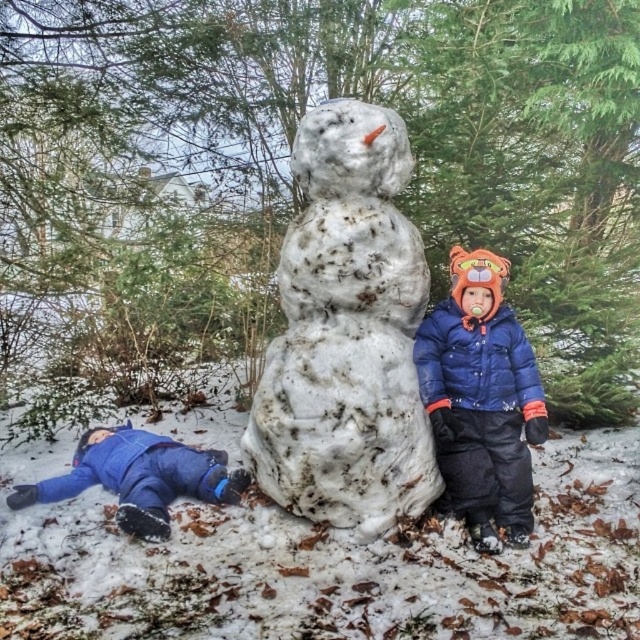
Based on the photo, you are a photographer trying to capture a photo of the blue down jacket at center and the white textured snowman at center. Based on their positions, which object should you focus on first if you want to include both in your shot without moving the camera?

The white textured snowman at center is to the left of the blue down jacket at center, so you should focus on the white textured snowman at center first to ensure both are in frame.

You are a parent looking for your child who is wearing a blue jacket. You see the blue down jacket at center and the blue fleece jacket at lower left. Which jacket is covering the other one?

The blue down jacket at center is positioned over the blue fleece jacket at lower left, so the blue down jacket at center is covering the blue fleece jacket at lower left.

You are a photographer trying to capture a photo of both the white textured snowman at center and the blue fleece jacket at lower left. Since the snowman is larger, where should you position yourself to ensure both are visible in the frame?

Since the white textured snowman at center is bigger than the blue fleece jacket at lower left, you should position yourself closer to the blue fleece jacket at lower left to balance their sizes in the photo.